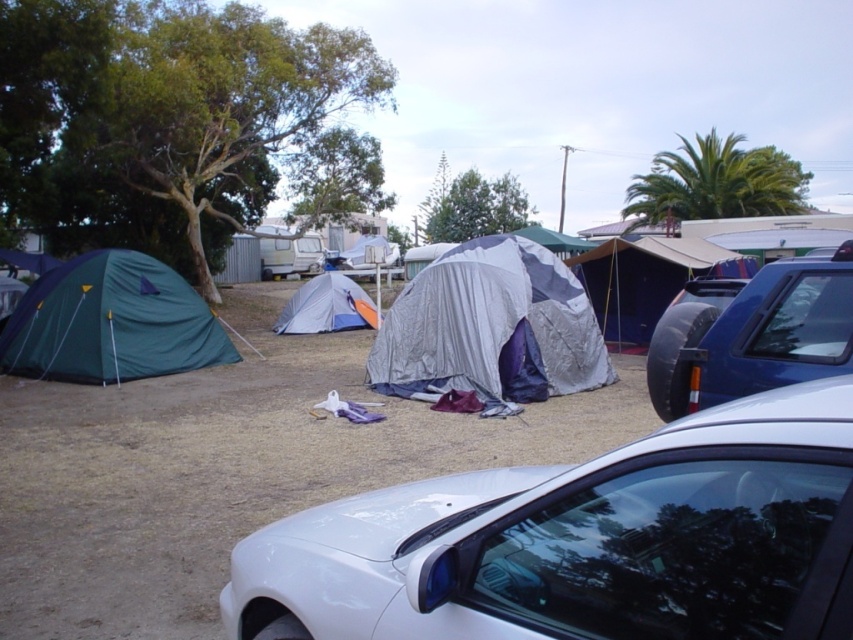
Question: Which of the following is the closest to the observer?

Choices:
 (A) (61, 371)
 (B) (792, 259)

Answer: (A)

Question: Considering the relative positions of brown dirt field at center and blue metallic car at right in the image provided, where is brown dirt field at center located with respect to blue metallic car at right?

Choices:
 (A) above
 (B) below

Answer: (B)

Question: Among these objects, which one is farthest from the camera?

Choices:
 (A) silver/reflective tent at center
 (B) green fabric tent at lower left
 (C) white glossy car at lower center

Answer: (B)

Question: Is brown dirt field at center to the right of silver/reflective tent at center from the viewer's perspective?

Choices:
 (A) yes
 (B) no

Answer: (B)

Question: Based on their relative distances, which object is farther from the blue metallic car at right?

Choices:
 (A) white glossy car at lower center
 (B) silver/reflective tent at center

Answer: (B)

Question: Does silver/reflective tent at center appear on the right side of green fabric tent at lower left?

Choices:
 (A) no
 (B) yes

Answer: (B)